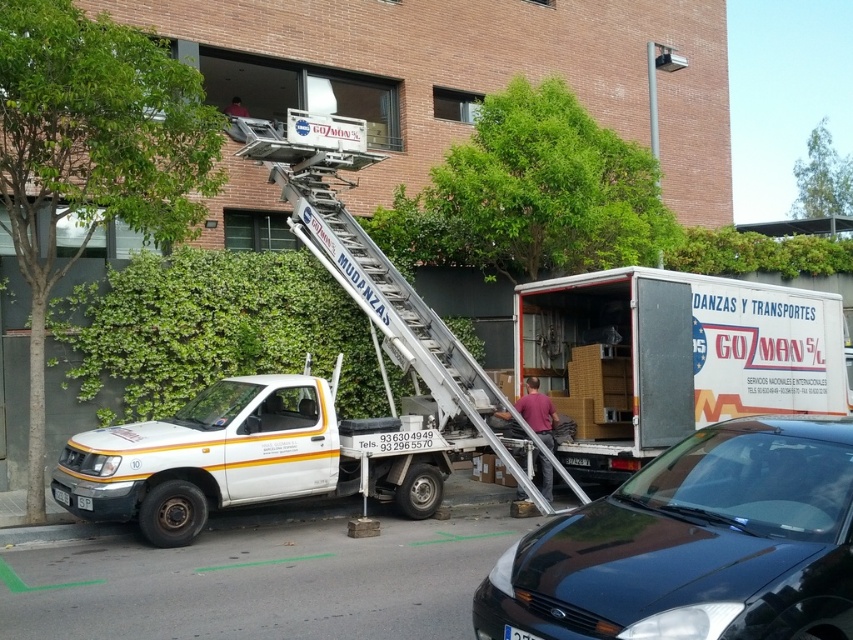
Question: Can you confirm if black matte car at center is thinner than black plastic license plate at lower center?

Choices:
 (A) yes
 (B) no

Answer: (B)

Question: Which object is positioned closest to the black matte car at center?

Choices:
 (A) white matte truck at lower left
 (B) metallic silver ladder at center
 (C) black plastic license plate at lower center
 (D) white cardboard boxes at center

Answer: (C)

Question: Which point is farther to the camera?

Choices:
 (A) (90, 499)
 (B) (527, 634)
 (C) (558, 381)

Answer: (C)

Question: Is black matte car at center thinner than white cardboard boxes at center?

Choices:
 (A) yes
 (B) no

Answer: (A)

Question: Which object is farther from the camera taking this photo?

Choices:
 (A) black plastic license plate at lower center
 (B) white cardboard boxes at center
 (C) metallic silver ladder at center

Answer: (B)

Question: Is white cardboard boxes at center below white matte truck at lower left?

Choices:
 (A) no
 (B) yes

Answer: (A)